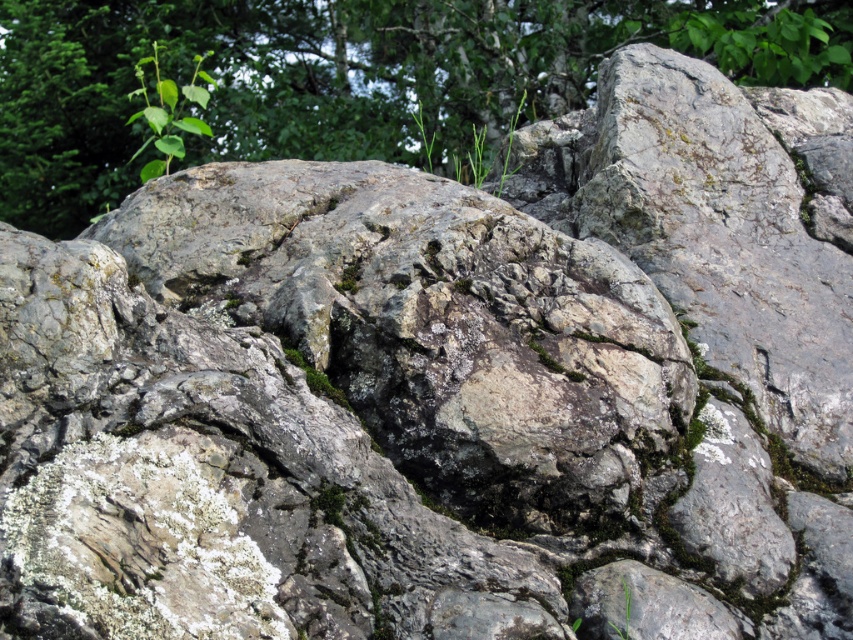
You are a botanist examining the rocky surface and notice the green leafy tree at upper center and the green grass at upper center. Which of these two plants is closer to your viewpoint?

The green leafy tree at upper center is closer to the viewer than the green grass at upper center based on their spatial arrangement.

You are a botanist studying plant growth in rocky environments. You observe the green leafy tree at upper center and the green leafy plant at upper left. Which one is positioned higher up in the image?

The green leafy tree at upper center is positioned higher up in the image than the green leafy plant at upper left.